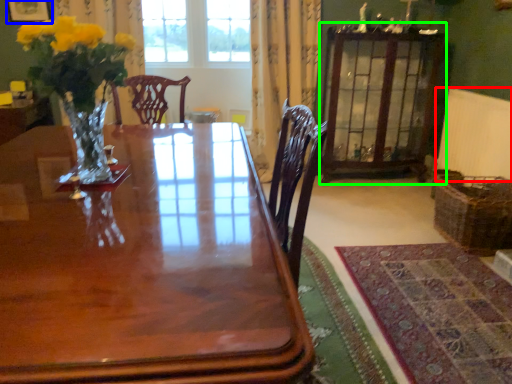
Question: Based on their relative distances, which object is farther from radiator (highlighted by a red box)? Choose from picture frame (highlighted by a blue box) and armoire (highlighted by a green box).

Choices:
 (A) picture frame
 (B) armoire

Answer: (A)